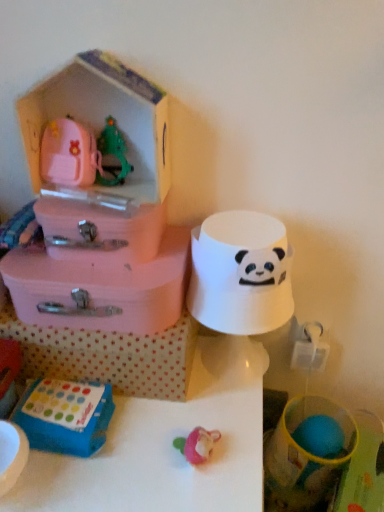
The width and height of the screenshot is (384, 512). In order to click on free point above white matte table at center (from a real-world perspective) in this screenshot , I will do `click(135, 422)`.